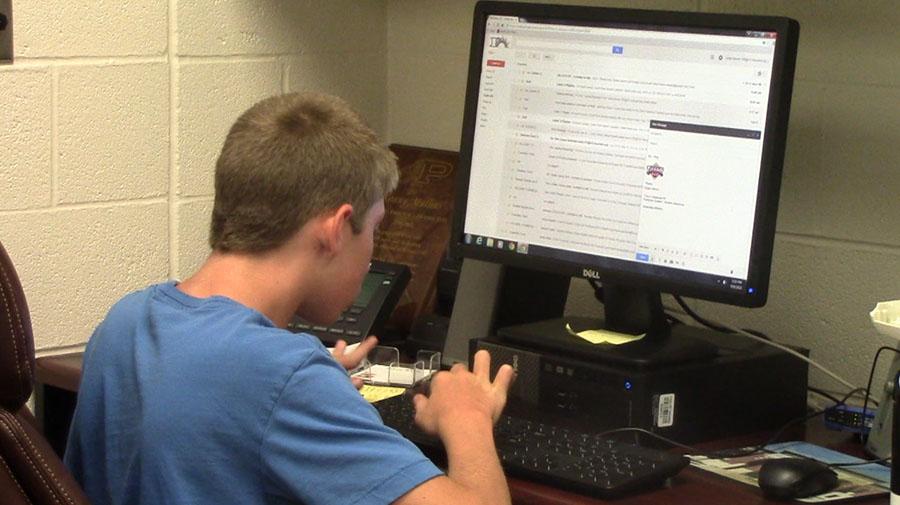
Where is `post-it notes`? Image resolution: width=900 pixels, height=505 pixels. post-it notes is located at coordinates (618, 336), (382, 394).